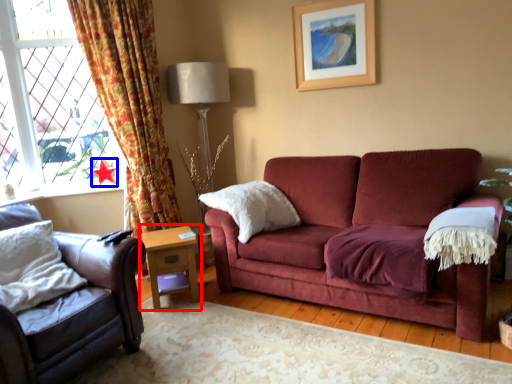
Question: Among these objects, which one is farthest to the camera, table (highlighted by a red box) or star (highlighted by a blue box)?

Choices:
 (A) table
 (B) star

Answer: (B)